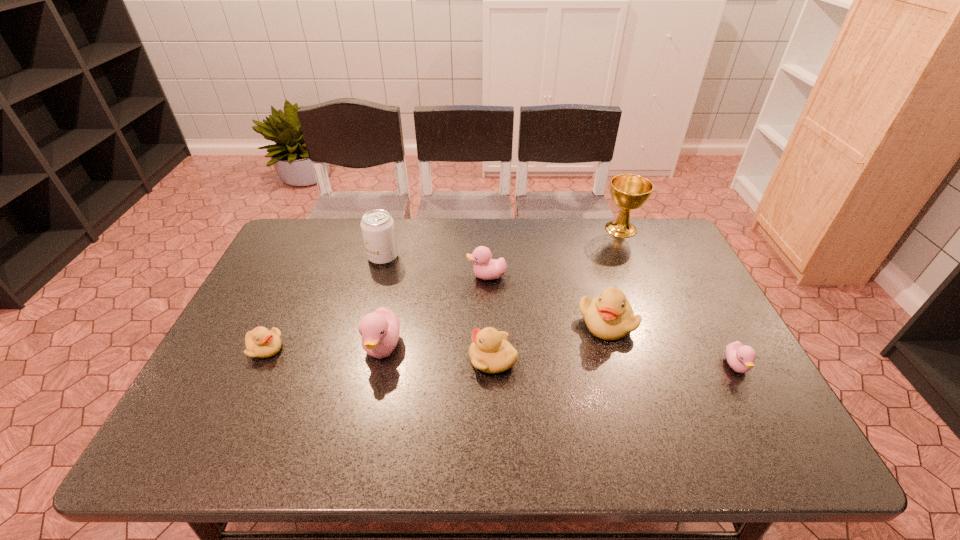
Identify the location of the rightmost pink duckling. (740, 357).

At what (x,y) coordinates should I click in order to perform the action: click on the rightmost duckling. Please return your answer as a coordinate pair (x, y). The image size is (960, 540). Looking at the image, I should click on pyautogui.click(x=740, y=357).

At what (x,y) coordinates should I click in order to perform the action: click on the leftmost duckling. Please return your answer as a coordinate pair (x, y). Looking at the image, I should click on (260, 342).

Locate an element on the screen. The width and height of the screenshot is (960, 540). the leftmost object is located at coordinates (260, 342).

In order to click on free location located on the front of the second object from right to left in this screenshot , I will do `click(660, 320)`.

Identify the location of blank space located 0.170m on the left of the soda can. (314, 257).

I want to click on free space located 0.090m on the front-facing side of the biggest pink duckling, so click(x=371, y=404).

This screenshot has width=960, height=540. I want to click on free space located 0.250m on the beak of the rightmost yellow duckling, so click(x=639, y=434).

The image size is (960, 540). In order to click on vacant area situated 0.200m on the front-facing side of the farthest pink duckling in this screenshot , I will do `click(400, 276)`.

Where is `vacant space located on the front-facing side of the farthest pink duckling`? vacant space located on the front-facing side of the farthest pink duckling is located at coordinates (400, 276).